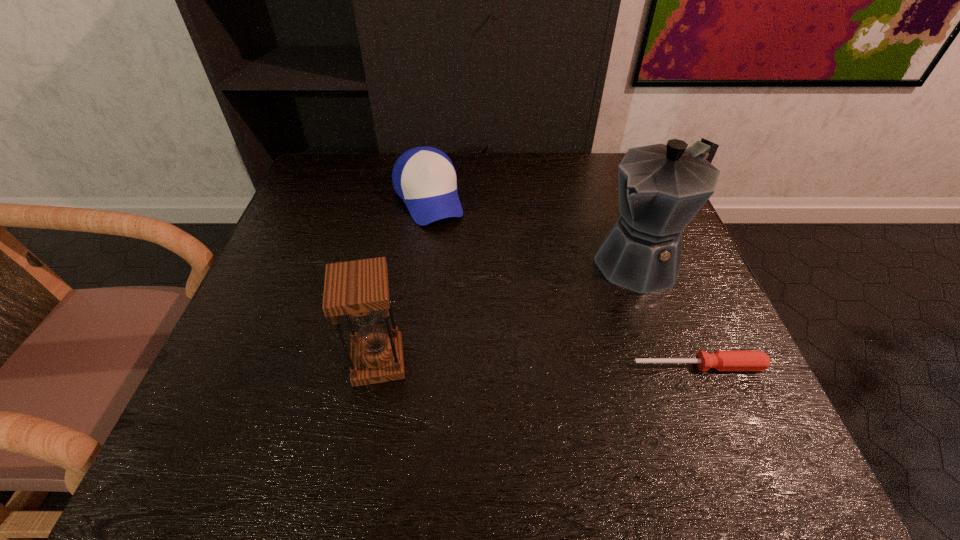
The image size is (960, 540). Find the location of `empty space between the tallest object and the baseball cap`. empty space between the tallest object and the baseball cap is located at coordinates (536, 230).

This screenshot has width=960, height=540. What are the coordinates of `free space between the hourglass and the tallest object` in the screenshot? It's located at (511, 311).

You are a GUI agent. You are given a task and a screenshot of the screen. Output one action in this format:
    pyautogui.click(x=<x>, y=<y>)
    Task: Click on the unoccupied position between the coffeepot and the second shortest object
    This screenshot has width=960, height=540.
    Given the screenshot: What is the action you would take?
    pyautogui.click(x=536, y=230)

Locate an element on the screen. The width and height of the screenshot is (960, 540). the third closest object to the third nearest object is located at coordinates pyautogui.click(x=359, y=289).

Locate an element on the screen. object that stands as the third closest to the hourglass is located at coordinates (720, 360).